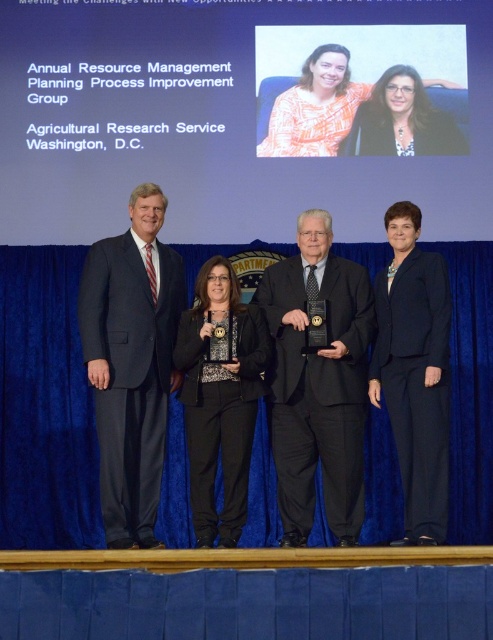
Question: Considering the real-world distances, which object is closest to the black textured pants at center?

Choices:
 (A) black matte suit at center
 (B) dark blue suit at right
 (C) dark gray suit at left
 (D) orange printed blouse at center

Answer: (C)

Question: Can you confirm if black matte suit at center is thinner than matte black blazer at center?

Choices:
 (A) no
 (B) yes

Answer: (A)

Question: Does dark blue suit at right have a larger size compared to matte black blazer at center?

Choices:
 (A) no
 (B) yes

Answer: (B)

Question: Among these objects, which one is nearest to the camera?

Choices:
 (A) black matte suit at center
 (B) matte black blazer at center
 (C) black textured pants at center

Answer: (C)

Question: Can you confirm if black textured pants at center is positioned above matte black blazer at center?

Choices:
 (A) no
 (B) yes

Answer: (A)

Question: Among these objects, which one is farthest from the camera?

Choices:
 (A) orange printed blouse at center
 (B) matte black blazer at center
 (C) black textured pants at center
 (D) dark blue suit at right

Answer: (A)